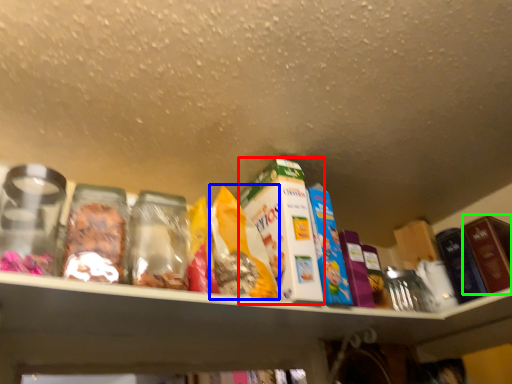
Question: Which object is the closest to the product (highlighted by a red box)? Choose among these: cereal (highlighted by a blue box) or product (highlighted by a green box).

Choices:
 (A) cereal
 (B) product

Answer: (A)